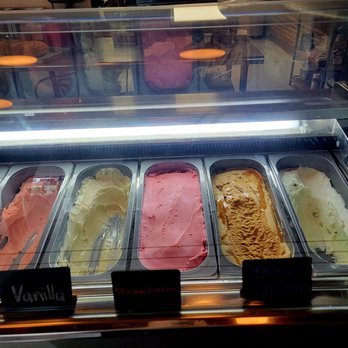
Find the location of a particular element. Image resolution: width=348 pixels, height=348 pixels. reflection of fluorescent light is located at coordinates (242, 129), (264, 126), (200, 131).